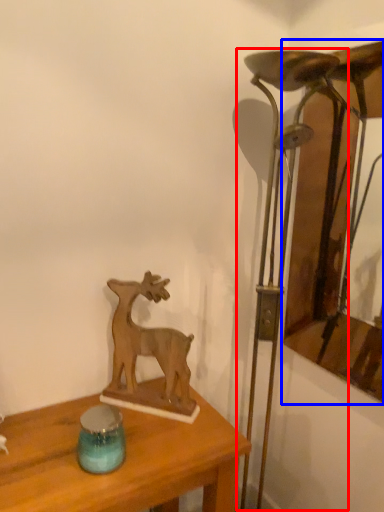
Question: Which object appears closest to the camera in this image, table lamp (highlighted by a red box) or picture frame (highlighted by a blue box)?

Choices:
 (A) table lamp
 (B) picture frame

Answer: (A)